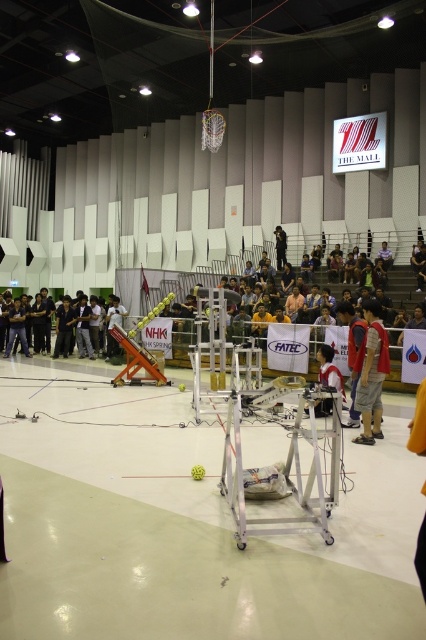
Can you confirm if dark gray shirt at center is wider than black matte person at center?

Correct, the width of dark gray shirt at center exceeds that of black matte person at center.

Can you confirm if dark gray shirt at center is positioned below black matte person at center?

Yes.

The width and height of the screenshot is (426, 640). Identify the location of dark gray shirt at center. (66, 326).

Which of these two, red fabric shirt at right or black matte person at center, stands shorter?

With less height is black matte person at center.

The height and width of the screenshot is (640, 426). What do you see at coordinates (371, 372) in the screenshot? I see `red fabric shirt at right` at bounding box center [371, 372].

The height and width of the screenshot is (640, 426). In order to click on red fabric shirt at right in this screenshot , I will do `click(371, 372)`.

Is red fabric shirt at right closer to camera compared to dark gray shirt at center?

Yes.

Looking at this image, is red fabric shirt at right further to the viewer compared to dark gray shirt at center?

No, it is not.

Find the location of a particular element. red fabric shirt at right is located at coordinates (371, 372).